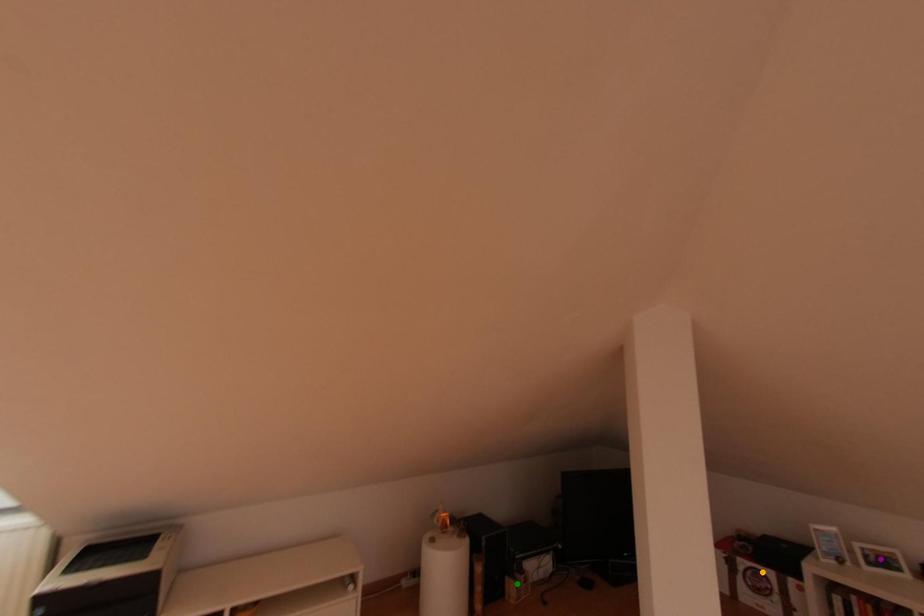
Order these from nearest to farthest:
green point | purple point | orange point

green point < orange point < purple point